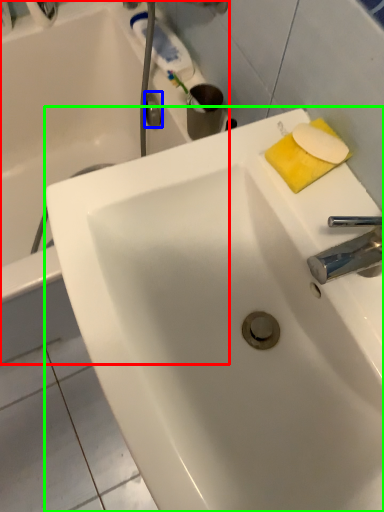
Question: Which object is the farthest from bathtub (highlighted by a red box)? Choose among these: plumbing fixture (highlighted by a blue box) or sink (highlighted by a green box).

Choices:
 (A) plumbing fixture
 (B) sink

Answer: (B)